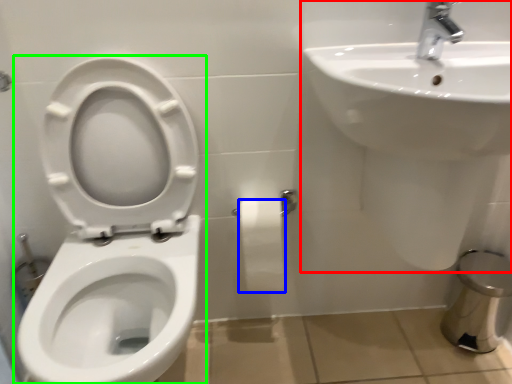
Question: Which object is positioned closest to sink (highlighted by a red box)? Select from toilet paper (highlighted by a blue box) and toilet (highlighted by a green box).

Choices:
 (A) toilet paper
 (B) toilet

Answer: (A)